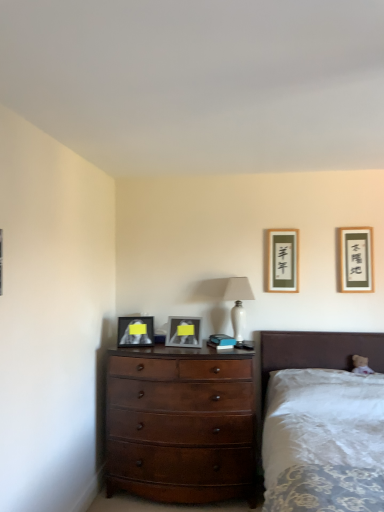
Question: From a real-world perspective, is white glossy table lamp at center below matte black picture frame at center, the first picture frame positioned from the left?

Choices:
 (A) yes
 (B) no

Answer: (B)

Question: Would you say white glossy table lamp at center is outside matte black picture frame at center, the first picture frame positioned from the left?

Choices:
 (A) yes
 (B) no

Answer: (A)

Question: From the image's perspective, is white glossy table lamp at center over matte black picture frame at center, the fourth picture frame positioned from the right?

Choices:
 (A) no
 (B) yes

Answer: (B)

Question: Considering the relative sizes of white glossy table lamp at center and matte black picture frame at center, the first picture frame positioned from the left, in the image provided, is white glossy table lamp at center smaller than matte black picture frame at center, the first picture frame positioned from the left,?

Choices:
 (A) no
 (B) yes

Answer: (A)

Question: Is white glossy table lamp at center looking in the opposite direction of matte black picture frame at center, the fourth picture frame positioned from the right?

Choices:
 (A) yes
 (B) no

Answer: (B)

Question: Does white glossy table lamp at center have a lesser height compared to matte black picture frame at center, the fourth picture frame positioned from the right?

Choices:
 (A) yes
 (B) no

Answer: (B)

Question: From a real-world perspective, is matte black picture frame at upper right, marked as the 1th picture frame in a right-to-left arrangement, below mahogany wood dresser at center?

Choices:
 (A) yes
 (B) no

Answer: (B)

Question: Considering the relative sizes of matte black picture frame at upper right, marked as the 1th picture frame in a right-to-left arrangement, and mahogany wood dresser at center in the image provided, is matte black picture frame at upper right, marked as the 1th picture frame in a right-to-left arrangement, thinner than mahogany wood dresser at center?

Choices:
 (A) yes
 (B) no

Answer: (A)

Question: Does matte black picture frame at upper right, marked as the 1th picture frame in a right-to-left arrangement, have a smaller size compared to mahogany wood dresser at center?

Choices:
 (A) no
 (B) yes

Answer: (B)

Question: Is matte black picture frame at upper right, marked as the 1th picture frame in a right-to-left arrangement, far from mahogany wood dresser at center?

Choices:
 (A) no
 (B) yes

Answer: (B)

Question: Is matte black picture frame at upper right, marked as the 1th picture frame in a right-to-left arrangement, located outside mahogany wood dresser at center?

Choices:
 (A) no
 (B) yes

Answer: (B)

Question: Does matte black picture frame at upper right, marked as the 1th picture frame in a right-to-left arrangement, turn towards mahogany wood dresser at center?

Choices:
 (A) yes
 (B) no

Answer: (B)

Question: Is the depth of matte silver picture frame at center, acting as the 3th picture frame starting from the right, less than that of white glossy table lamp at center?

Choices:
 (A) yes
 (B) no

Answer: (A)